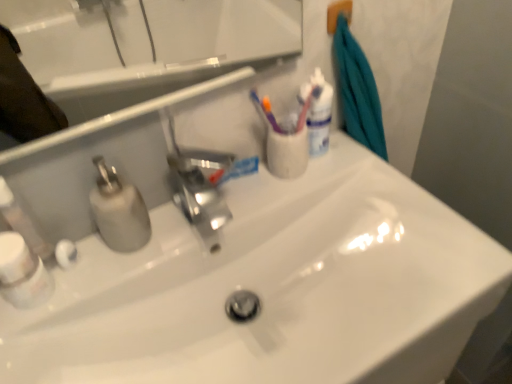
The image size is (512, 384). What do you see at coordinates (234, 170) in the screenshot? I see `white glossy toothpaste at center` at bounding box center [234, 170].

What do you see at coordinates (22, 222) in the screenshot? I see `white plastic soap dispenser at left` at bounding box center [22, 222].

This screenshot has height=384, width=512. What are the coordinates of `white glossy mouthwash at upper right, which is the first mouthwash from right to left` in the screenshot? It's located at (317, 112).

Image resolution: width=512 pixels, height=384 pixels. What are the coordinates of `white glossy toothpaste at center` in the screenshot? It's located at (x=234, y=170).

In the image, is white plastic soap dispenser at left positioned in front of or behind white glossy sink at center?

Visually, white plastic soap dispenser at left is located behind white glossy sink at center.

Is white plastic soap dispenser at left taller or shorter than white glossy sink at center?

Clearly, white plastic soap dispenser at left is taller compared to white glossy sink at center.

From the image's perspective, is white plastic soap dispenser at left located beneath white glossy sink at center?

No.

Is white plastic soap dispenser at left in front of or behind white plastic bottle at lower left, the second mouthwash positioned from the right, in the image?

white plastic soap dispenser at left is positioned farther from the viewer than white plastic bottle at lower left, the second mouthwash positioned from the right.

From the image's perspective, would you say white plastic soap dispenser at left is positioned over white plastic bottle at lower left, arranged as the second mouthwash when viewed from the back?

Correct, white plastic soap dispenser at left appears higher than white plastic bottle at lower left, arranged as the second mouthwash when viewed from the back, in the image.

Considering the relative sizes of white plastic soap dispenser at left and white plastic bottle at lower left, the 1th mouthwash when ordered from front to back, in the image provided, is white plastic soap dispenser at left bigger than white plastic bottle at lower left, the 1th mouthwash when ordered from front to back,?

Actually, white plastic soap dispenser at left might be smaller than white plastic bottle at lower left, the 1th mouthwash when ordered from front to back.

Consider the image. Does white plastic soap dispenser at left have a greater height compared to white plastic bottle at lower left, the 2th mouthwash viewed from the top?

Correct, white plastic soap dispenser at left is much taller as white plastic bottle at lower left, the 2th mouthwash viewed from the top.

Would you say white glossy sink at center is inside or outside white glossy mouthwash at upper right, the second mouthwash when ordered from left to right?

white glossy sink at center is spatially situated outside white glossy mouthwash at upper right, the second mouthwash when ordered from left to right.

Between white glossy sink at center and white glossy mouthwash at upper right, which appears as the 2th mouthwash when viewed from the front, which one appears on the right side from the viewer's perspective?

white glossy mouthwash at upper right, which appears as the 2th mouthwash when viewed from the front, is more to the right.

Find the location of a particular element. This screenshot has width=512, height=384. sink below the white glossy mouthwash at upper right, which is counted as the first mouthwash, starting from the back (from the image's perspective) is located at coordinates (273, 289).

Is white glossy sink at center facing away from white glossy mouthwash at upper right, which appears as the 2th mouthwash when viewed from the front?

No, white glossy sink at center's orientation is not away from white glossy mouthwash at upper right, which appears as the 2th mouthwash when viewed from the front.

Does white glossy mouthwash at upper right, which is counted as the first mouthwash, starting from the back, have a larger size compared to white plastic bottle at lower left, the first mouthwash in the left-to-right sequence?

Indeed, white glossy mouthwash at upper right, which is counted as the first mouthwash, starting from the back, has a larger size compared to white plastic bottle at lower left, the first mouthwash in the left-to-right sequence.

Relative to white plastic bottle at lower left, the 1th mouthwash when ordered from front to back, is white glossy mouthwash at upper right, which is the first mouthwash from right to left, in front or behind?

white glossy mouthwash at upper right, which is the first mouthwash from right to left, is positioned farther from the viewer than white plastic bottle at lower left, the 1th mouthwash when ordered from front to back.

Which of these two, white glossy mouthwash at upper right, which is the first mouthwash from right to left, or white plastic bottle at lower left, arranged as the second mouthwash when viewed from the back, stands shorter?

white plastic bottle at lower left, arranged as the second mouthwash when viewed from the back.

Can we say white glossy mouthwash at upper right, which is the first mouthwash in top-to-bottom order, lies outside white plastic bottle at lower left, the 1th mouthwash when ordered from front to back?

Absolutely, white glossy mouthwash at upper right, which is the first mouthwash in top-to-bottom order, is external to white plastic bottle at lower left, the 1th mouthwash when ordered from front to back.

Is white glossy mouthwash at upper right, which is counted as the first mouthwash, starting from the back, thinner than white glossy sink at center?

Yes, white glossy mouthwash at upper right, which is counted as the first mouthwash, starting from the back, is thinner than white glossy sink at center.

Is point (324, 152) farther from camera compared to point (495, 255)?

Yes, it is behind point (495, 255).

How far apart are white glossy mouthwash at upper right, which is the first mouthwash in top-to-bottom order, and white glossy sink at center?

They are 11.35 inches apart.

Which of these two, white glossy mouthwash at upper right, which is the first mouthwash in top-to-bottom order, or white glossy sink at center, is smaller?

Smaller between the two is white glossy mouthwash at upper right, which is the first mouthwash in top-to-bottom order.

Is the position of white glossy mouthwash at upper right, which is the first mouthwash from right to left, less distant than that of white plastic soap dispenser at left?

No, white glossy mouthwash at upper right, which is the first mouthwash from right to left, is behind white plastic soap dispenser at left.

Which of these two, white glossy mouthwash at upper right, which is counted as the first mouthwash, starting from the back, or white plastic soap dispenser at left, stands shorter?

white plastic soap dispenser at left is shorter.

From a real-world perspective, is white glossy mouthwash at upper right, the second mouthwash when ordered from left to right, positioned under white plastic soap dispenser at left based on gravity?

Correct, in the physical world, white glossy mouthwash at upper right, the second mouthwash when ordered from left to right, is lower than white plastic soap dispenser at left.

From the image's perspective, is white glossy mouthwash at upper right, positioned as the 2th mouthwash in bottom-to-top order, located above white plastic soap dispenser at left?

Yes.

From a real-world perspective, between white plastic bottle at lower left, the second mouthwash positioned from the right, and white plastic soap dispenser at left, who is vertically higher?

white plastic soap dispenser at left is physically above.

From the image's perspective, is white plastic bottle at lower left, the 2th mouthwash viewed from the top, on white plastic soap dispenser at left?

No, from the image's perspective, white plastic bottle at lower left, the 2th mouthwash viewed from the top, is not on top of white plastic soap dispenser at left.

Is white plastic bottle at lower left, arranged as the second mouthwash when viewed from the back, positioned far away from white plastic soap dispenser at left?

No, there isn't a large distance between white plastic bottle at lower left, arranged as the second mouthwash when viewed from the back, and white plastic soap dispenser at left.

Locate an element on the screen. toiletry located above the white glossy sink at center (from the image's perspective) is located at coordinates tap(22, 222).

Identify the location of toiletry above the white plastic bottle at lower left, the second mouthwash positioned from the right (from a real-world perspective). (22, 222).

Consider the image. Which object lies nearer to the anchor point white glossy toothpaste at center, white glossy sink at center or white plastic bottle at lower left, the 1th mouthwash when ordered from front to back?

white glossy sink at center.

When comparing their distances from white glossy sink at center, does white glossy toothpaste at center or white glossy mouthwash at upper right, which is the first mouthwash from right to left, seem further?

Among the two, white glossy mouthwash at upper right, which is the first mouthwash from right to left, is located further to white glossy sink at center.

Based on their spatial positions, is white plastic bottle at lower left, arranged as the first mouthwash when ordered from the bottom, or white glossy sink at center closer to white plastic soap dispenser at left?

Based on the image, white plastic bottle at lower left, arranged as the first mouthwash when ordered from the bottom, appears to be nearer to white plastic soap dispenser at left.

Estimate the real-world distances between objects in this image. Which object is closer to white glossy toothpaste at center, white glossy mouthwash at upper right, which is counted as the first mouthwash, starting from the back, or white plastic soap dispenser at left?

white glossy mouthwash at upper right, which is counted as the first mouthwash, starting from the back.

Estimate the real-world distances between objects in this image. Which object is closer to white glossy sink at center, white glossy mouthwash at upper right, which is counted as the first mouthwash, starting from the back, or white plastic soap dispenser at left?

The object closer to white glossy sink at center is white glossy mouthwash at upper right, which is counted as the first mouthwash, starting from the back.

When comparing their distances from white plastic soap dispenser at left, does white plastic bottle at lower left, the 1th mouthwash when ordered from front to back, or white glossy toothpaste at center seem further?

white glossy toothpaste at center is positioned further to the anchor white plastic soap dispenser at left.

From the image, which object appears to be nearer to white plastic soap dispenser at left, white glossy toothpaste at center or white plastic bottle at lower left, arranged as the first mouthwash when ordered from the bottom?

Based on the image, white plastic bottle at lower left, arranged as the first mouthwash when ordered from the bottom, appears to be nearer to white plastic soap dispenser at left.

Which object lies further to the anchor point white plastic bottle at lower left, arranged as the second mouthwash when viewed from the back, white glossy sink at center or white glossy mouthwash at upper right, the second mouthwash when ordered from left to right?

The object further to white plastic bottle at lower left, arranged as the second mouthwash when viewed from the back, is white glossy mouthwash at upper right, the second mouthwash when ordered from left to right.

This screenshot has width=512, height=384. I want to click on toiletry located between white glossy sink at center and white glossy toothpaste at center in the depth direction, so click(x=22, y=222).

This screenshot has height=384, width=512. Find the location of `sink between white plastic soap dispenser at left and white glossy mouthwash at upper right, which is counted as the first mouthwash, starting from the back, in the horizontal direction`. sink between white plastic soap dispenser at left and white glossy mouthwash at upper right, which is counted as the first mouthwash, starting from the back, in the horizontal direction is located at coordinates (273, 289).

Identify the location of mouthwash between white plastic soap dispenser at left and white glossy toothpaste at center in the horizontal direction. This screenshot has width=512, height=384. (22, 273).

Identify the location of mouthwash between white plastic soap dispenser at left and white glossy mouthwash at upper right, positioned as the 2th mouthwash in bottom-to-top order, in the horizontal direction. (22, 273).